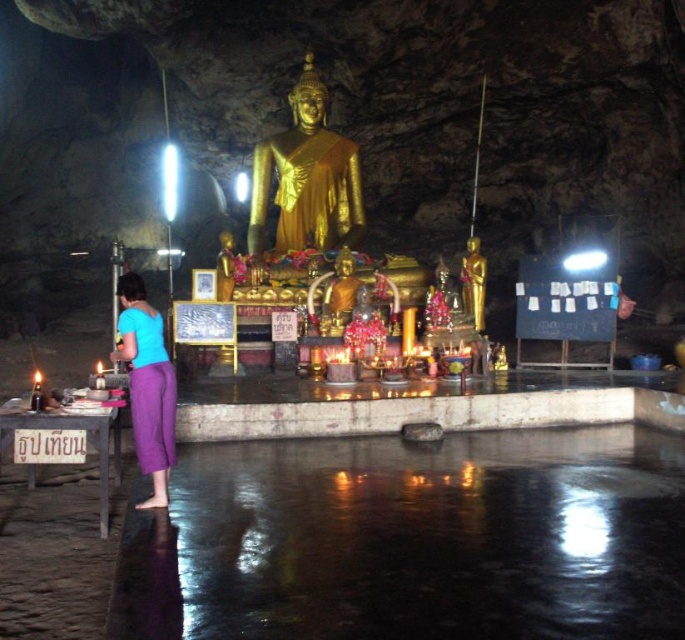
Describe the element at coordinates (306, 177) in the screenshot. This screenshot has width=685, height=640. I see `gold polished statue at center` at that location.

Describe the element at coordinates (306, 177) in the screenshot. I see `gold polished statue at center` at that location.

I want to click on gold polished statue at center, so click(306, 177).

Consider the image. Can you confirm if purple cotton pants at lower left is positioned to the right of gold metallic statue at center?

Incorrect, purple cotton pants at lower left is not on the right side of gold metallic statue at center.

In the scene shown: Is purple cotton pants at lower left wider than gold metallic statue at center?

Correct, the width of purple cotton pants at lower left exceeds that of gold metallic statue at center.

Who is more forward, (162, 413) or (469, 243)?

Positioned in front is point (162, 413).

Where is `purple cotton pants at lower left`? This screenshot has height=640, width=685. purple cotton pants at lower left is located at coordinates (147, 385).

Which is below, gold polished statue at center or purple cotton pants at lower left?

Positioned lower is purple cotton pants at lower left.

Which is more to the right, gold polished statue at center or purple cotton pants at lower left?

From the viewer's perspective, gold polished statue at center appears more on the right side.

Does point (345, 145) lie behind point (161, 412)?

That is True.

The height and width of the screenshot is (640, 685). Find the location of `gold polished statue at center`. gold polished statue at center is located at coordinates (306, 177).